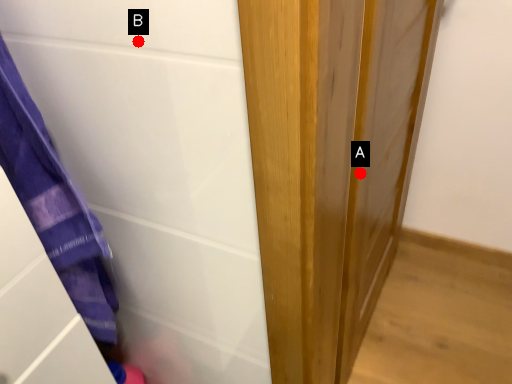
Question: Two points are circled on the image, labeled by A and B beside each circle. Which point is closer to the camera taking this photo?

Choices:
 (A) A is closer
 (B) B is closer

Answer: (B)